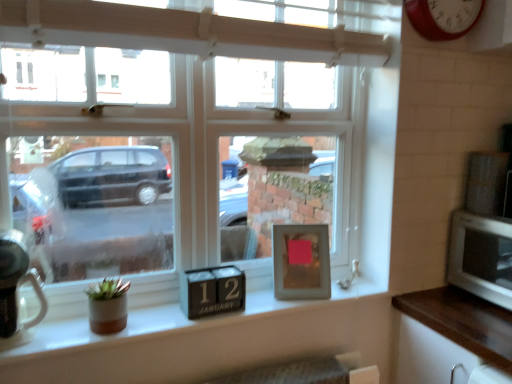
Question: Can you confirm if white glossy microwave at right, positioned as the first appliance in top-to-bottom order, is taller than brushed metal kettle at left, which ranks as the 2th appliance in top-to-bottom order?

Choices:
 (A) no
 (B) yes

Answer: (A)

Question: Can you confirm if white glossy microwave at right, the second appliance from the left, is shorter than brushed metal kettle at left, the 2th appliance viewed from the back?

Choices:
 (A) yes
 (B) no

Answer: (A)

Question: Is white glossy microwave at right, the second appliance from the left, bigger than brushed metal kettle at left, acting as the 2th appliance starting from the right?

Choices:
 (A) yes
 (B) no

Answer: (B)

Question: From a real-world perspective, is white glossy microwave at right, the second appliance from the left, positioned under brushed metal kettle at left, which ranks as the 2th appliance in top-to-bottom order, based on gravity?

Choices:
 (A) yes
 (B) no

Answer: (B)

Question: Are white glossy microwave at right, the second appliance from the left, and brushed metal kettle at left, which ranks as the 2th appliance in top-to-bottom order, located far from each other?

Choices:
 (A) no
 (B) yes

Answer: (B)

Question: Does white glossy microwave at right, placed as the first appliance when sorted from right to left, have a lesser width compared to brushed metal kettle at left, placed as the 1th appliance when sorted from front to back?

Choices:
 (A) yes
 (B) no

Answer: (B)

Question: Considering the relative sizes of brown wood counter top at lower right and white glossy microwave at right, which appears as the 1th appliance when viewed from the back, in the image provided, is brown wood counter top at lower right smaller than white glossy microwave at right, which appears as the 1th appliance when viewed from the back,?

Choices:
 (A) no
 (B) yes

Answer: (A)

Question: Is brown wood counter top at lower right shorter than white glossy microwave at right, placed as the first appliance when sorted from right to left?

Choices:
 (A) yes
 (B) no

Answer: (B)

Question: Does brown wood counter top at lower right contain white glossy microwave at right, placed as the first appliance when sorted from right to left?

Choices:
 (A) no
 (B) yes

Answer: (A)

Question: Does brown wood counter top at lower right turn towards white glossy microwave at right, the second appliance from the left?

Choices:
 (A) yes
 (B) no

Answer: (B)

Question: Can you confirm if brown wood counter top at lower right is thinner than white glossy microwave at right, the 2th appliance positioned from the bottom?

Choices:
 (A) yes
 (B) no

Answer: (B)

Question: Does brown wood counter top at lower right have a greater height compared to white glossy microwave at right, the 2th appliance when ordered from front to back?

Choices:
 (A) yes
 (B) no

Answer: (A)

Question: Is red metallic clock at upper right outside silver metallic microwave at right?

Choices:
 (A) no
 (B) yes

Answer: (B)